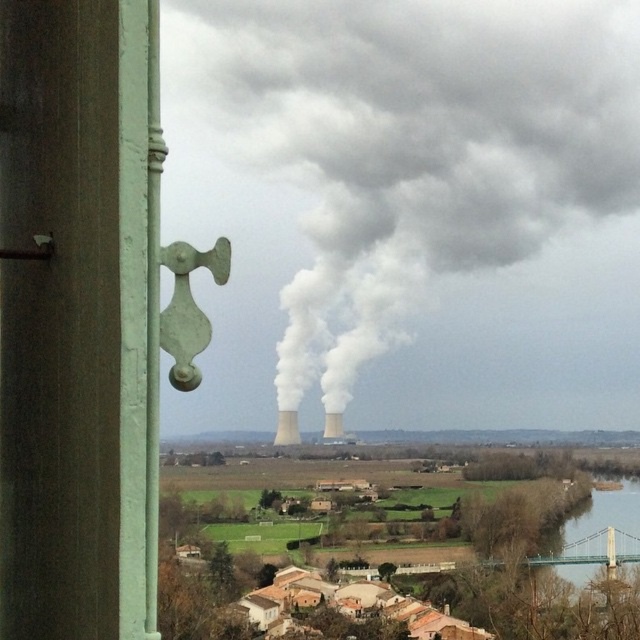
Where is the smooth concrete chimney at center located in the image?

The smooth concrete chimney at center is located at point coordinates of (285, 428).